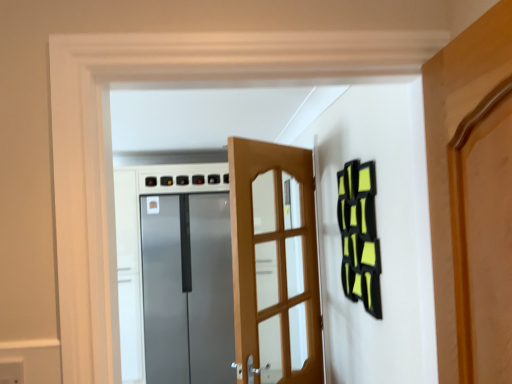
Describe the element at coordinates (273, 260) in the screenshot. Image resolution: width=512 pixels, height=384 pixels. I see `wooden door at center, arranged as the second door when viewed from the back` at that location.

At what (x,y) coordinates should I click in order to perform the action: click on satin metallic refrigerator at center, acting as the 2th door starting from the right. Please return your answer as a coordinate pair (x, y). Looking at the image, I should click on [188, 290].

The image size is (512, 384). Describe the element at coordinates (11, 370) in the screenshot. I see `matte gray electric outlet at lower left` at that location.

Locate an element on the screen. This screenshot has height=384, width=512. wooden door at center, acting as the first door starting from the front is located at coordinates (273, 260).

Considering the sizes of objects matte gray electric outlet at lower left and wooden door at center, acting as the first door starting from the front, in the image provided, who is taller, matte gray electric outlet at lower left or wooden door at center, acting as the first door starting from the front,?

Standing taller between the two is wooden door at center, acting as the first door starting from the front.

How many degrees apart are the facing directions of matte gray electric outlet at lower left and wooden door at center, arranged as the second door when viewed from the back?

matte gray electric outlet at lower left and wooden door at center, arranged as the second door when viewed from the back, are facing 128 degrees away from each other.

Considering the relative positions of matte gray electric outlet at lower left and wooden door at center, acting as the first door starting from the front, in the image provided, is matte gray electric outlet at lower left to the right of wooden door at center, acting as the first door starting from the front, from the viewer's perspective?

No.

Between matte gray electric outlet at lower left and wooden door at center, the second door from the left, which one has smaller size?

matte gray electric outlet at lower left.

From a real-world perspective, is satin metallic refrigerator at center, acting as the 2th door starting from the right, positioned over matte gray electric outlet at lower left based on gravity?

Incorrect, from a real-world perspective, satin metallic refrigerator at center, acting as the 2th door starting from the right, is lower than matte gray electric outlet at lower left.

Between satin metallic refrigerator at center, placed as the first door when sorted from left to right, and matte gray electric outlet at lower left, which one has larger size?

With larger size is satin metallic refrigerator at center, placed as the first door when sorted from left to right.

Are satin metallic refrigerator at center, positioned as the first door in back-to-front order, and matte gray electric outlet at lower left making contact?

They are not placed beside each other.

This screenshot has height=384, width=512. I want to click on electric outlet that appears above the satin metallic refrigerator at center, placed as the 2th door when sorted from front to back (from a real-world perspective), so 11,370.

What's the angular difference between wooden door at center, arranged as the second door when viewed from the back, and matte gray electric outlet at lower left's facing directions?

They differ by 128 degrees in their facing directions.

Which object is closer to the camera, wooden door at center, positioned as the first door in right-to-left order, or matte gray electric outlet at lower left?

matte gray electric outlet at lower left is in front.

Is point (266, 352) closer to camera compared to point (12, 371)?

No, it is not.

Is matte gray electric outlet at lower left located within wooden door at center, positioned as the first door in right-to-left order?

Actually, matte gray electric outlet at lower left is outside wooden door at center, positioned as the first door in right-to-left order.

From the picture: Does satin metallic refrigerator at center, placed as the 2th door when sorted from front to back, have a lesser height compared to wooden door at center, the second door from the left?

No.

In the scene shown: Is satin metallic refrigerator at center, placed as the 2th door when sorted from front to back, turned away from wooden door at center, positioned as the first door in right-to-left order?

satin metallic refrigerator at center, placed as the 2th door when sorted from front to back, does not have its back to wooden door at center, positioned as the first door in right-to-left order.

Identify the location of door below the wooden door at center, positioned as the first door in right-to-left order (from the image's perspective). (188, 290).

Considering the relative sizes of matte gray electric outlet at lower left and satin metallic refrigerator at center, positioned as the first door in back-to-front order, in the image provided, is matte gray electric outlet at lower left bigger than satin metallic refrigerator at center, positioned as the first door in back-to-front order,?

Incorrect, matte gray electric outlet at lower left is not larger than satin metallic refrigerator at center, positioned as the first door in back-to-front order.

From a real-world perspective, which is physically below, matte gray electric outlet at lower left or satin metallic refrigerator at center, placed as the first door when sorted from left to right?

In real-world perspective, satin metallic refrigerator at center, placed as the first door when sorted from left to right, is lower.

Which is more to the right, matte gray electric outlet at lower left or satin metallic refrigerator at center, placed as the 2th door when sorted from front to back?

matte gray electric outlet at lower left is more to the right.

Can we say matte gray electric outlet at lower left lies outside satin metallic refrigerator at center, acting as the 2th door starting from the right?

matte gray electric outlet at lower left lies outside satin metallic refrigerator at center, acting as the 2th door starting from the right,'s area.

From a real-world perspective, is wooden door at center, acting as the first door starting from the front, on top of satin metallic refrigerator at center, placed as the first door when sorted from left to right?

Yes.

Is wooden door at center, the second door from the left, next to satin metallic refrigerator at center, placed as the first door when sorted from left to right?

There is a gap between wooden door at center, the second door from the left, and satin metallic refrigerator at center, placed as the first door when sorted from left to right.

You are a GUI agent. You are given a task and a screenshot of the screen. Output one action in this format:
    pyautogui.click(x=<x>, y=<y>)
    Task: Click on the door above the satin metallic refrigerator at center, acting as the 2th door starting from the right (from a real-world perspective)
    This screenshot has width=512, height=384.
    Given the screenshot: What is the action you would take?
    pyautogui.click(x=273, y=260)

Which is farther, [282,338] or [178,348]?

The point [178,348] is farther.

Where is `electric outlet above the wooden door at center, the second door from the left (from the image's perspective)`? This screenshot has height=384, width=512. electric outlet above the wooden door at center, the second door from the left (from the image's perspective) is located at coordinates (11, 370).

This screenshot has width=512, height=384. Find the location of `the 2nd door located beneath the matte gray electric outlet at lower left (from a real-world perspective)`. the 2nd door located beneath the matte gray electric outlet at lower left (from a real-world perspective) is located at coordinates (188, 290).

Based on their spatial positions, is wooden door at center, the second door from the left, or matte gray electric outlet at lower left further from satin metallic refrigerator at center, placed as the 2th door when sorted from front to back?

matte gray electric outlet at lower left is further to satin metallic refrigerator at center, placed as the 2th door when sorted from front to back.

When comparing their distances from matte gray electric outlet at lower left, does satin metallic refrigerator at center, positioned as the first door in back-to-front order, or wooden door at center, positioned as the first door in right-to-left order, seem closer?

wooden door at center, positioned as the first door in right-to-left order, is closer to matte gray electric outlet at lower left.

Considering their positions, is matte gray electric outlet at lower left positioned closer to satin metallic refrigerator at center, positioned as the first door in back-to-front order, than wooden door at center, acting as the first door starting from the front?

Based on the image, wooden door at center, acting as the first door starting from the front, appears to be nearer to satin metallic refrigerator at center, positioned as the first door in back-to-front order.

Considering their positions, is wooden door at center, positioned as the first door in right-to-left order, positioned closer to matte gray electric outlet at lower left than satin metallic refrigerator at center, acting as the 2th door starting from the right?

Based on the image, wooden door at center, positioned as the first door in right-to-left order, appears to be nearer to matte gray electric outlet at lower left.

Which object lies nearer to the anchor point wooden door at center, arranged as the second door when viewed from the back, satin metallic refrigerator at center, acting as the 2th door starting from the right, or matte gray electric outlet at lower left?

Among the two, matte gray electric outlet at lower left is located nearer to wooden door at center, arranged as the second door when viewed from the back.

When comparing their distances from wooden door at center, positioned as the first door in right-to-left order, does matte gray electric outlet at lower left or satin metallic refrigerator at center, positioned as the first door in back-to-front order, seem further?

Among the two, satin metallic refrigerator at center, positioned as the first door in back-to-front order, is located further to wooden door at center, positioned as the first door in right-to-left order.

Where is `door positioned between matte gray electric outlet at lower left and satin metallic refrigerator at center, acting as the 2th door starting from the right, from near to far`? This screenshot has height=384, width=512. door positioned between matte gray electric outlet at lower left and satin metallic refrigerator at center, acting as the 2th door starting from the right, from near to far is located at coordinates tap(273, 260).